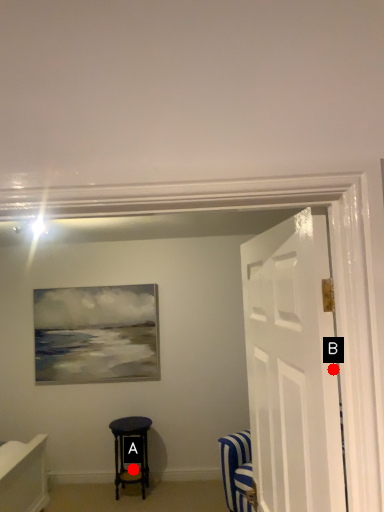
Question: Two points are circled on the image, labeled by A and B beside each circle. Which point is farther from the camera taking this photo?

Choices:
 (A) A is further
 (B) B is further

Answer: (A)